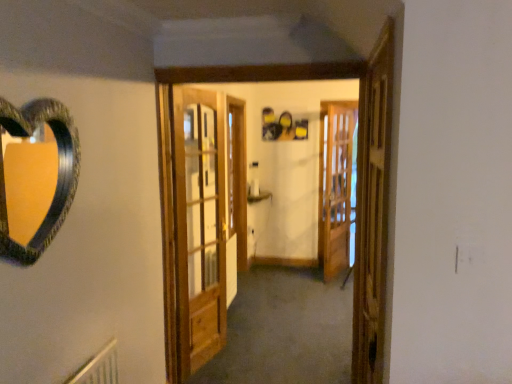
Question: Is wooden screen door at center, which is the 1th screen door in right-to-left order, in front of wooden door at center?

Choices:
 (A) yes
 (B) no

Answer: (B)

Question: Considering the relative sizes of wooden screen door at center, acting as the 2th screen door starting from the left, and wooden door at center in the image provided, is wooden screen door at center, acting as the 2th screen door starting from the left, shorter than wooden door at center?

Choices:
 (A) yes
 (B) no

Answer: (A)

Question: Is wooden screen door at center, which is the 1th screen door in right-to-left order, oriented away from wooden door at center?

Choices:
 (A) yes
 (B) no

Answer: (B)

Question: Is wooden screen door at center, the first screen door positioned from the back, at the right side of wooden door at center?

Choices:
 (A) yes
 (B) no

Answer: (A)

Question: Can you confirm if wooden screen door at center, marked as the second screen door in a front-to-back arrangement, is wider than wooden door at center?

Choices:
 (A) yes
 (B) no

Answer: (B)

Question: From a real-world perspective, is wooden screen door at right, positioned as the 1th screen door in front-to-back order, above or below wooden screen door at center, acting as the 2th screen door starting from the left?

Choices:
 (A) below
 (B) above

Answer: (B)

Question: Considering the relative positions of wooden screen door at right, the first screen door when ordered from left to right, and wooden screen door at center, marked as the second screen door in a front-to-back arrangement, in the image provided, is wooden screen door at right, the first screen door when ordered from left to right, to the left or to the right of wooden screen door at center, marked as the second screen door in a front-to-back arrangement,?

Choices:
 (A) right
 (B) left

Answer: (B)

Question: In terms of height, does wooden screen door at right, the first screen door when ordered from left to right, look taller or shorter compared to wooden screen door at center, acting as the 2th screen door starting from the left?

Choices:
 (A) tall
 (B) short

Answer: (B)

Question: Is wooden screen door at right, which is the second screen door from back to front, wider or thinner than wooden screen door at center, which is the 1th screen door in right-to-left order?

Choices:
 (A) wide
 (B) thin

Answer: (A)

Question: Looking at the image, does wooden door at center seem bigger or smaller compared to wooden screen door at right, the 2th screen door from the right?

Choices:
 (A) small
 (B) big

Answer: (B)

Question: In terms of height, does wooden door at center look taller or shorter compared to wooden screen door at right, which is the second screen door from back to front?

Choices:
 (A) tall
 (B) short

Answer: (A)

Question: Looking at their shapes, would you say wooden door at center is wider or thinner than wooden screen door at right, positioned as the 1th screen door in front-to-back order?

Choices:
 (A) thin
 (B) wide

Answer: (B)

Question: From a real-world perspective, is wooden door at center physically located above or below wooden screen door at right, positioned as the 1th screen door in front-to-back order?

Choices:
 (A) above
 (B) below

Answer: (B)

Question: Based on their sizes in the image, would you say wooden screen door at right, the 2th screen door from the right, is bigger or smaller than wooden door at center?

Choices:
 (A) big
 (B) small

Answer: (B)

Question: From the image's perspective, relative to wooden door at center, is wooden screen door at right, positioned as the 1th screen door in front-to-back order, above or below?

Choices:
 (A) above
 (B) below

Answer: (B)